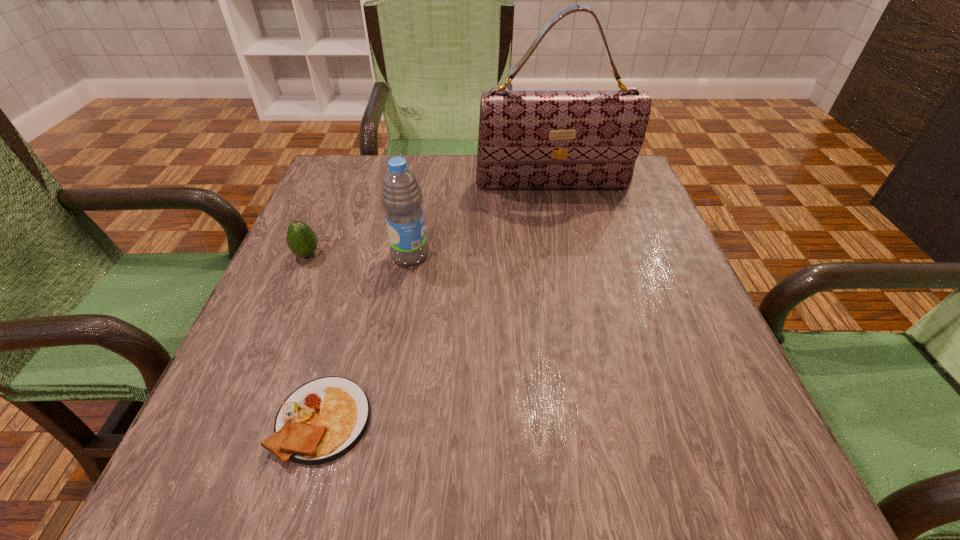
Identify the location of vacant space located 0.100m on the back of the shortest object. pos(348,331).

Find the location of `object present at the far edge`. object present at the far edge is located at coordinates (528, 139).

Locate an element on the screen. This screenshot has height=540, width=960. object situated at the near edge is located at coordinates (322, 420).

You are a GUI agent. You are given a task and a screenshot of the screen. Output one action in this format:
    pyautogui.click(x=<x>, y=<y>)
    Task: Click on the avocado that is at the left edge
    
    Given the screenshot: What is the action you would take?
    pyautogui.click(x=301, y=239)

Where is `omelet that is at the left edge`? omelet that is at the left edge is located at coordinates (322, 420).

Find the location of a particular element. This screenshot has height=540, width=960. object located in the right edge section of the desktop is located at coordinates (528, 139).

This screenshot has width=960, height=540. I want to click on object that is at the near left corner, so click(322, 420).

Locate an element on the screen. This screenshot has height=540, width=960. object that is at the far right corner is located at coordinates (528, 139).

In the image, there is a desktop. Where is `vacant space at the far edge`? vacant space at the far edge is located at coordinates (445, 199).

In the image, there is a desktop. Where is `vacant space at the near edge`? This screenshot has width=960, height=540. vacant space at the near edge is located at coordinates (451, 463).